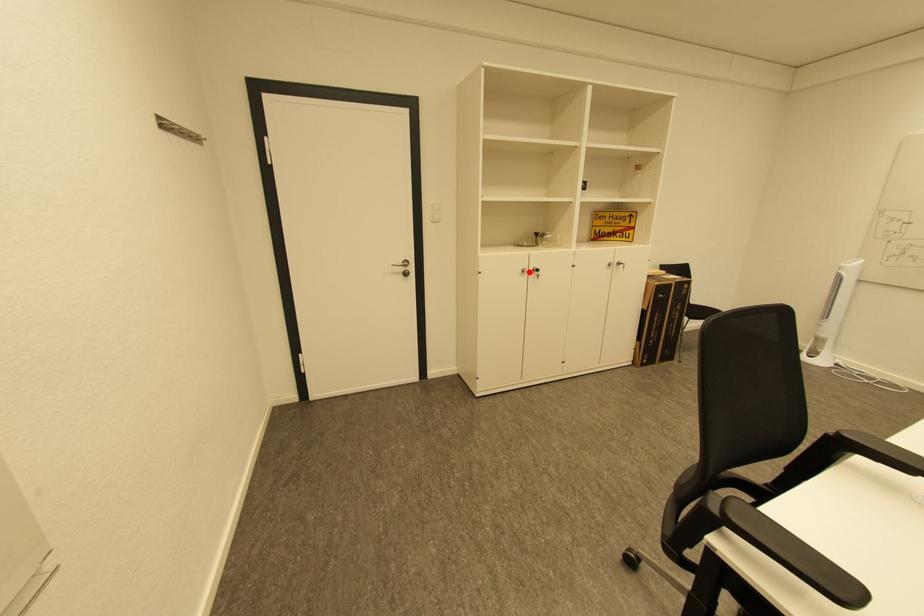
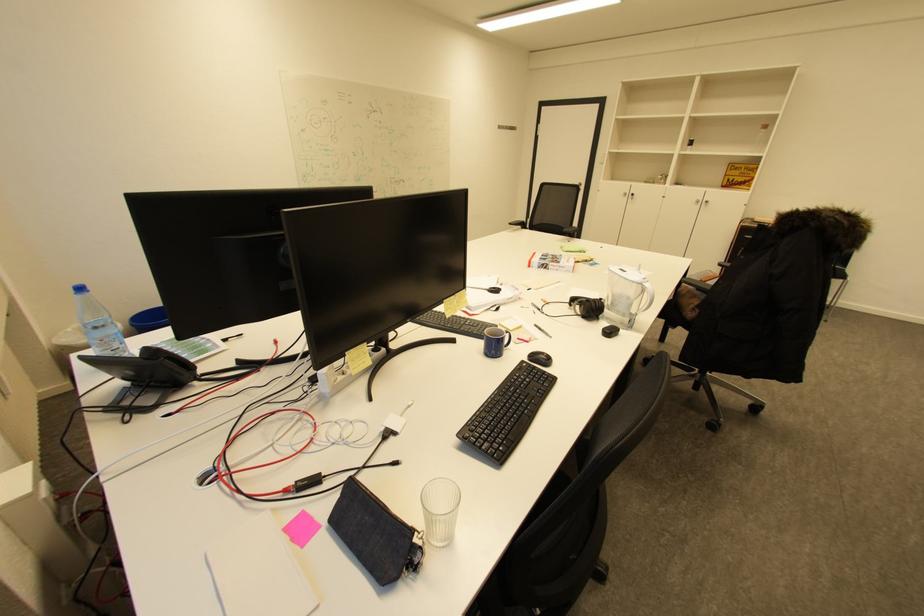
The point at the highlighted location is marked in the first image. Where is the corresponding point in the second image?

(630, 195)